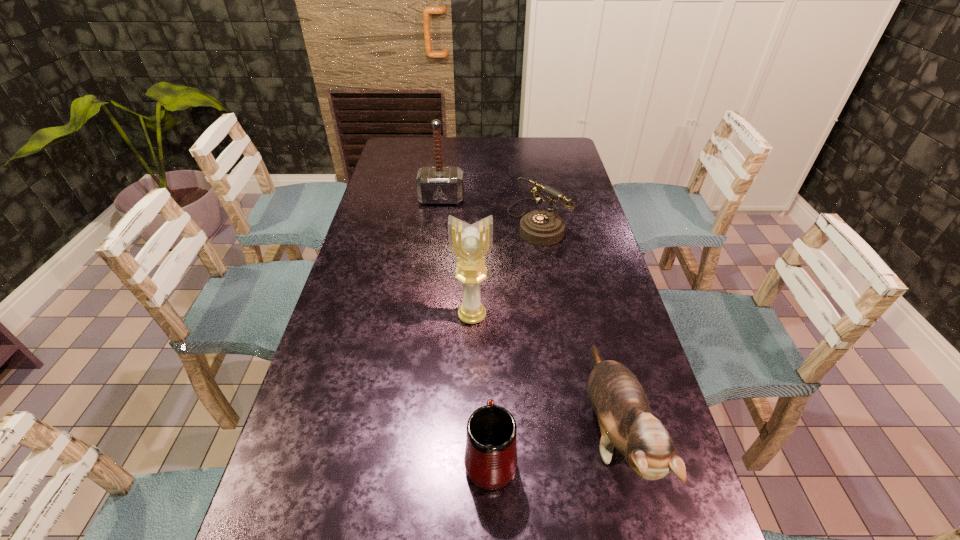
In order to click on free location located on the side of the mug with the handle in this screenshot , I will do `click(489, 374)`.

The image size is (960, 540). What are the coordinates of `cat that is at the right edge` in the screenshot? It's located at (618, 399).

Find the location of a particular element. telephone at the right edge is located at coordinates (540, 227).

Locate an element on the screen. The width and height of the screenshot is (960, 540). free spot at the left edge of the desktop is located at coordinates (416, 180).

Where is `blank area at the right edge`? This screenshot has width=960, height=540. blank area at the right edge is located at coordinates (629, 307).

Locate an element on the screen. The width and height of the screenshot is (960, 540). vacant area at the far left corner of the desktop is located at coordinates (384, 161).

Identify the location of free spot between the telephone and the mug. This screenshot has width=960, height=540. (514, 339).

Find the location of `vacant space that is in between the hammer and the telephone`. vacant space that is in between the hammer and the telephone is located at coordinates (489, 210).

Locate an element on the screen. The image size is (960, 540). free space between the mug and the award is located at coordinates (481, 387).

At what (x,y) coordinates should I click in order to perform the action: click on unoccupied position between the hammer and the mug. Please return your answer as a coordinate pair (x, y). Looking at the image, I should click on (466, 328).